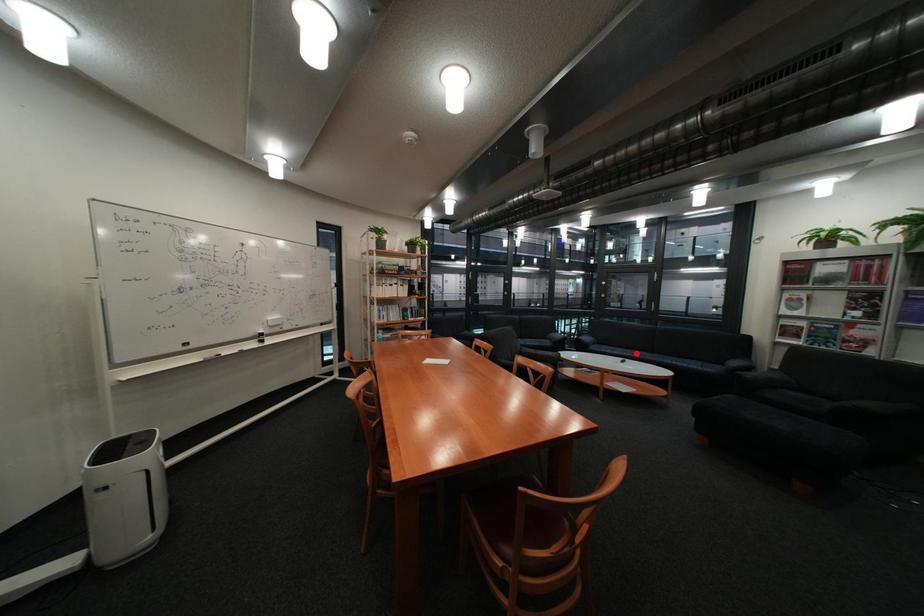
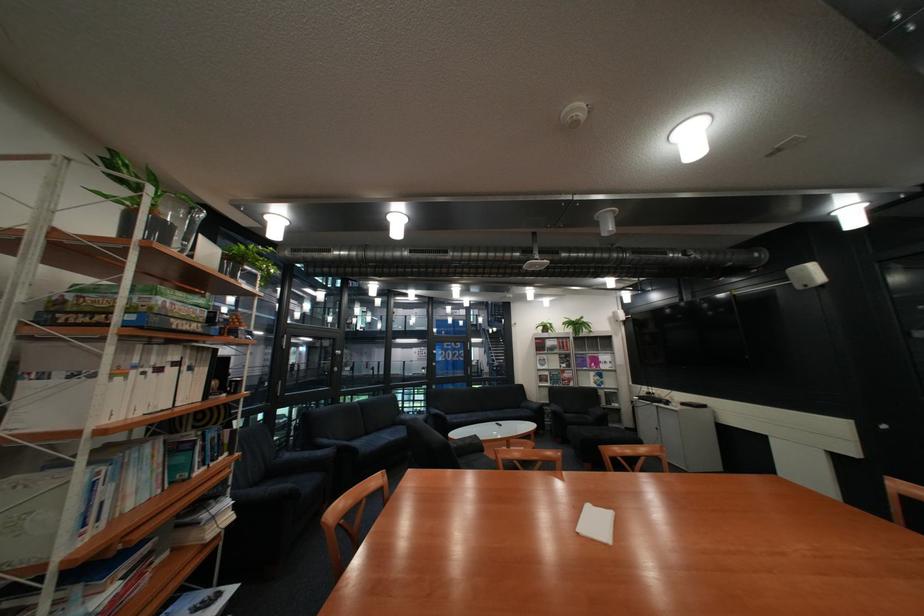
The point at the highlighted location is marked in the first image. Where is the corresponding point in the second image?

(490, 418)